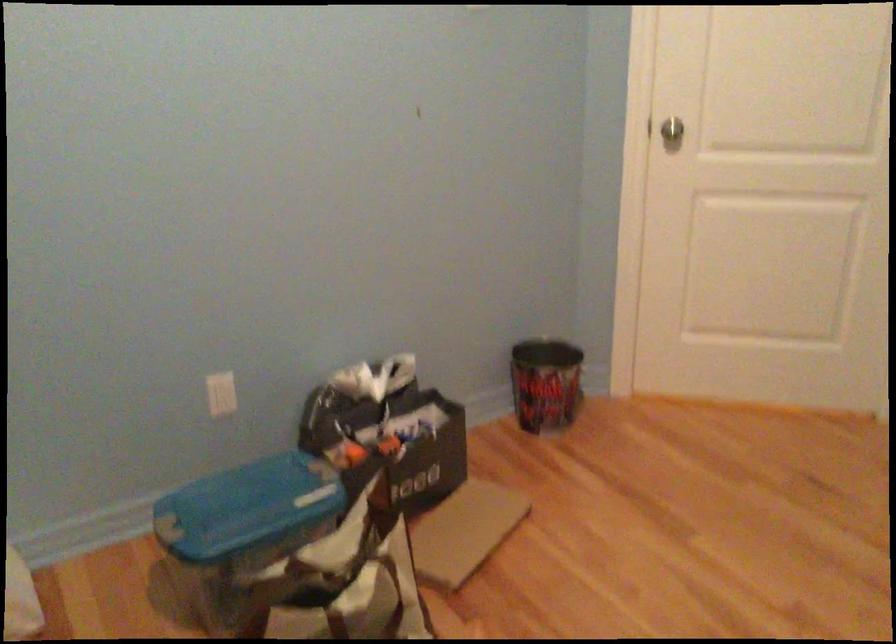
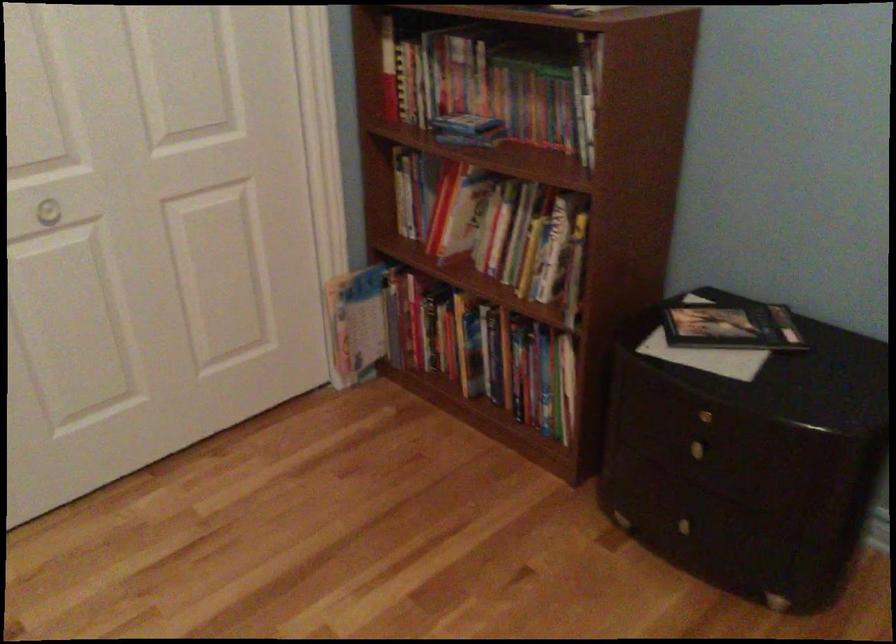
Based on the continuous images, in which direction is the camera rotating?

The camera's rotation is toward right-down.